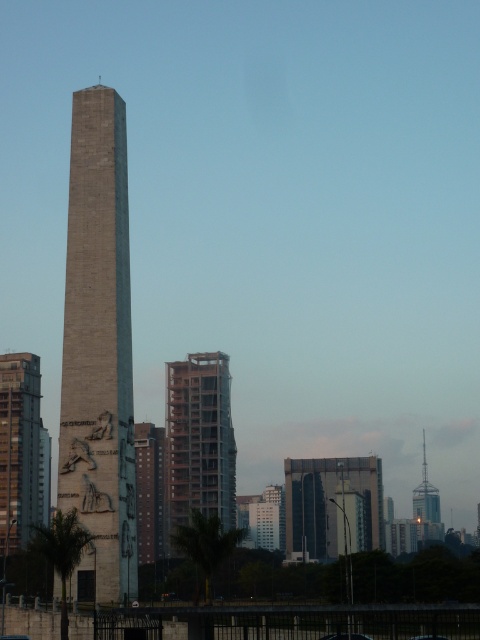
Does smooth concrete tower at left appear on the left side of shiny metallic tower at right?

Indeed, smooth concrete tower at left is positioned on the left side of shiny metallic tower at right.

Between point (16, 384) and point (420, 484), which one is positioned in front?

Point (16, 384) is in front.

At what (x,y) coordinates should I click in order to perform the action: click on smooth concrete tower at left. Please return your answer as a coordinate pair (x, y). The image size is (480, 640). Looking at the image, I should click on (23, 468).

Is smooth concrete building at center further to camera compared to smooth concrete tower at left?

Yes, it is.

Who is more distant from viewer, [186,483] or [39,387]?

Point [39,387]

What are the coordinates of `smooth concrete building at center` in the screenshot? It's located at (199, 442).

This screenshot has width=480, height=640. Identify the location of gray stone obelisk at center. pyautogui.click(x=98, y=349).

Locate an element on the screen. The width and height of the screenshot is (480, 640). gray stone obelisk at center is located at coordinates (98, 349).